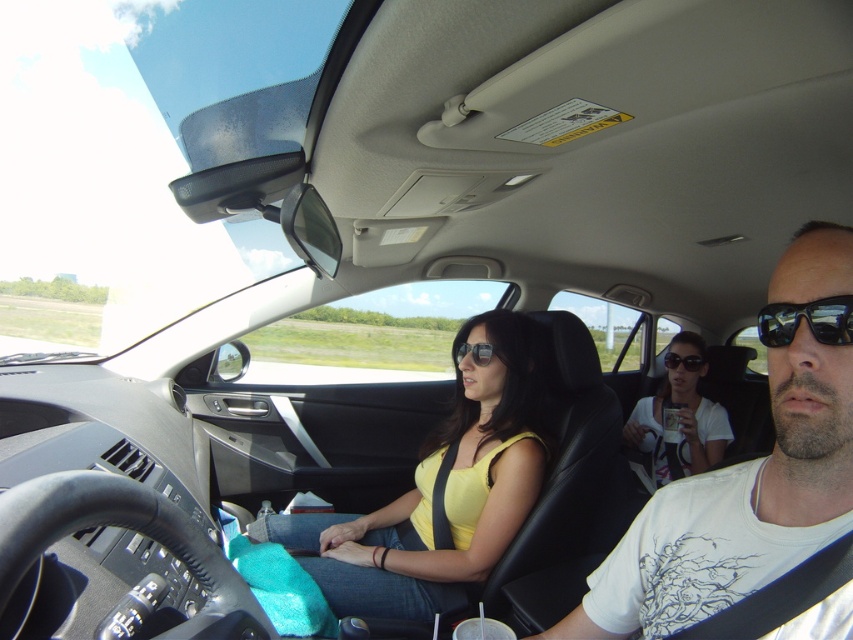
Who is more forward, (668,499) or (764,332)?

Point (764,332) is more forward.

Who is positioned more to the right, white cotton t-shirt at center or sunglasses at center?

sunglasses at center

Is point (782, 454) positioned in front of point (776, 324)?

No, it is not.

Where is `white cotton t-shirt at center`? The height and width of the screenshot is (640, 853). white cotton t-shirt at center is located at coordinates (734, 512).

Can you confirm if white cotton t-shirt at center is positioned to the right of black plastic goggles at center?

In fact, white cotton t-shirt at center is to the left of black plastic goggles at center.

Is point (776, 298) positioned after point (693, 356)?

No, (776, 298) is closer to viewer.

Find the location of `white cotton t-shirt at center`. white cotton t-shirt at center is located at coordinates (734, 512).

Is white cotton t-shirt at center wider than yellow fabric shirt at center?

No, white cotton t-shirt at center is not wider than yellow fabric shirt at center.

Who is positioned more to the right, white cotton t-shirt at center or yellow fabric shirt at center?

From the viewer's perspective, white cotton t-shirt at center appears more on the right side.

Is point (807, 525) positioned behind point (538, 412)?

No, it is in front of (538, 412).

Find the location of `white cotton t-shirt at center`. white cotton t-shirt at center is located at coordinates (734, 512).